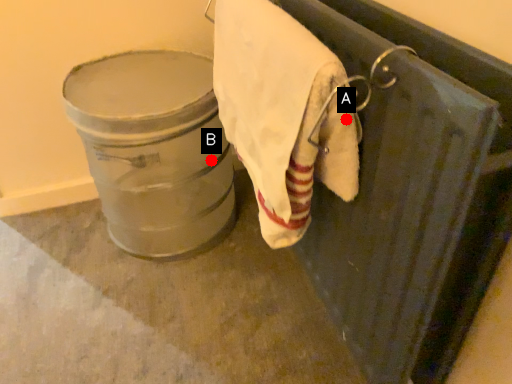
Question: Two points are circled on the image, labeled by A and B beside each circle. Which point is farther from the camera taking this photo?

Choices:
 (A) A is further
 (B) B is further

Answer: (B)